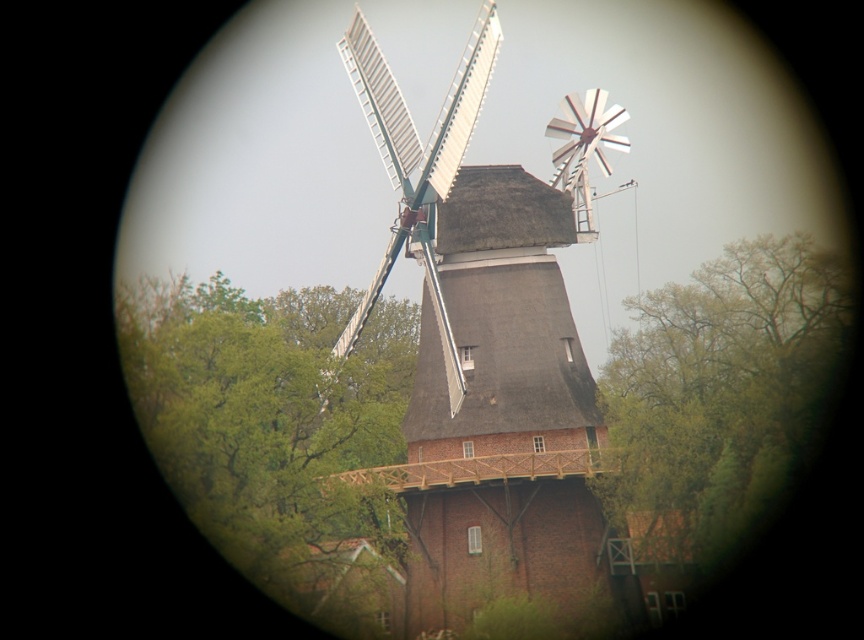
Question: In this image, where is brown wooden windmill at center located relative to white painted wood windmill at center?

Choices:
 (A) above
 (B) below

Answer: (B)

Question: Which point is closer to the camera taking this photo?

Choices:
 (A) (731, 355)
 (B) (308, 561)
 (C) (399, 192)
 (D) (437, 284)

Answer: (B)

Question: Does green leafy tree at lower left lie in front of green leafy tree at center?

Choices:
 (A) yes
 (B) no

Answer: (A)

Question: Estimate the real-world distances between objects in this image. Which object is farther from the white painted wood windmill at center?

Choices:
 (A) green leafy tree at lower left
 (B) brown wooden windmill at center
 (C) green leafy tree at center

Answer: (C)

Question: Is green leafy tree at center closer to the viewer compared to white painted wood windmill at center?

Choices:
 (A) yes
 (B) no

Answer: (B)

Question: Which point appears farthest from the camera in this image?

Choices:
 (A) (180, 442)
 (B) (553, 531)
 (C) (351, 74)
 (D) (729, 342)

Answer: (C)